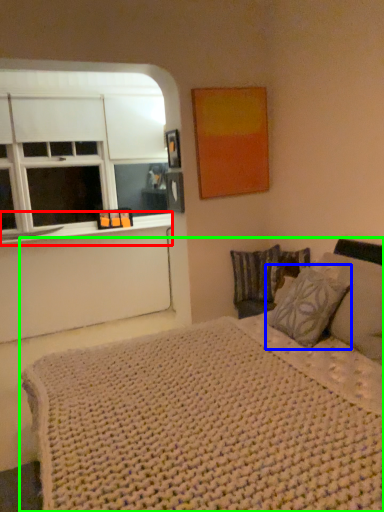
Question: Which object is the closest to the window sill (highlighted by a red box)? Choose among these: pillow (highlighted by a blue box) or bed (highlighted by a green box).

Choices:
 (A) pillow
 (B) bed

Answer: (A)